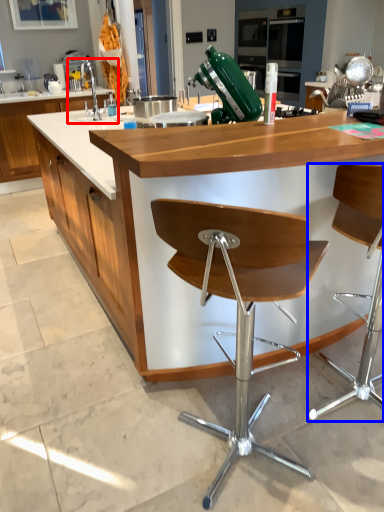
Question: Which object is further to the camera taking this photo, sink (highlighted by a red box) or chair (highlighted by a blue box)?

Choices:
 (A) sink
 (B) chair

Answer: (A)